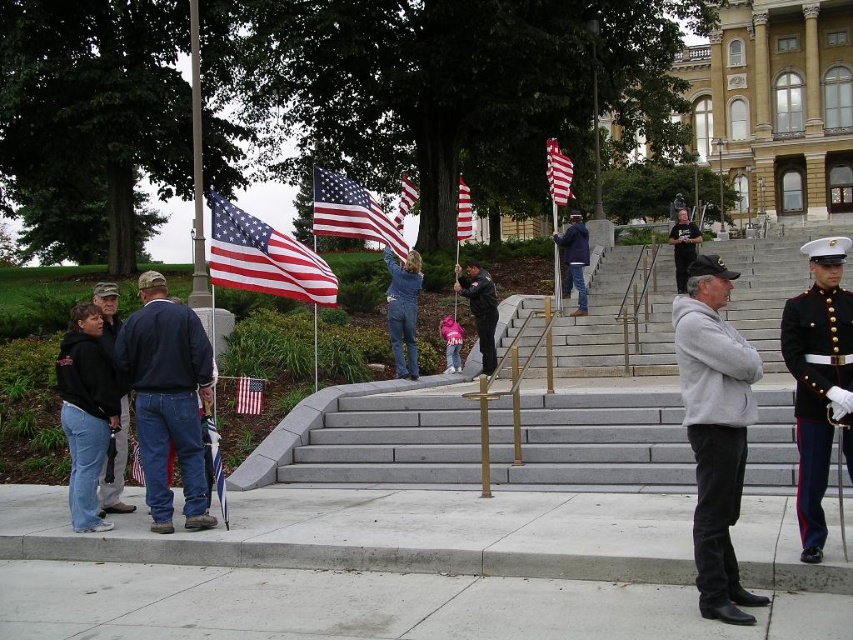
You are a photographer positioned at the bottom of the steps. You want to capture a photo that includes both the black cotton hoodie at lower left and the black leather uniform at center. Which object should you adjust your camera angle to focus on first to ensure both are in frame?

Since the black cotton hoodie at lower left is in front of the black leather uniform at center, you should focus on the black leather uniform at center first to ensure the black cotton hoodie at lower left doesn not block it in the photo.

You are a photographer standing at the bottom of the steps. You want to capture both the gray fleece jacket at center and the black fleece hoodie at lower left in a single photo. Given that your camera has a maximum angle of view of 50 feet, can you fit both subjects into the frame without moving?

The gray fleece jacket at center and the black fleece hoodie at lower left are 49.30 feet apart, so yes, the photographer can fit both subjects into the frame since the distance between them is within the camera maximum angle of view of 50 feet.

You are a photographer positioned at the bottom of the steps. You need to capture a photo of both the black cotton hoodie at lower left and the black leather uniform at center without any obstructions. Based on their positions, which subject should you focus on first to ensure both are in frame?

The black cotton hoodie at lower left is below the black leather uniform at center, so you should focus on the black leather uniform at center first to ensure both are in frame.